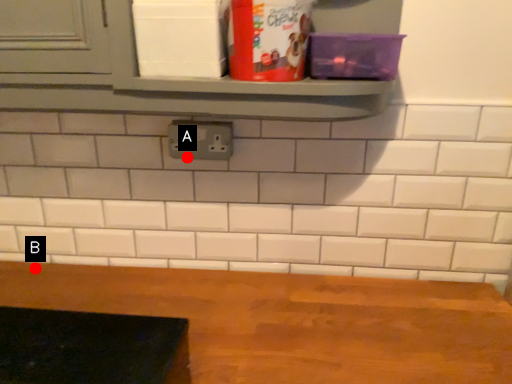
Question: Two points are circled on the image, labeled by A and B beside each circle. Which point is closer to the camera?

Choices:
 (A) A is closer
 (B) B is closer

Answer: (A)